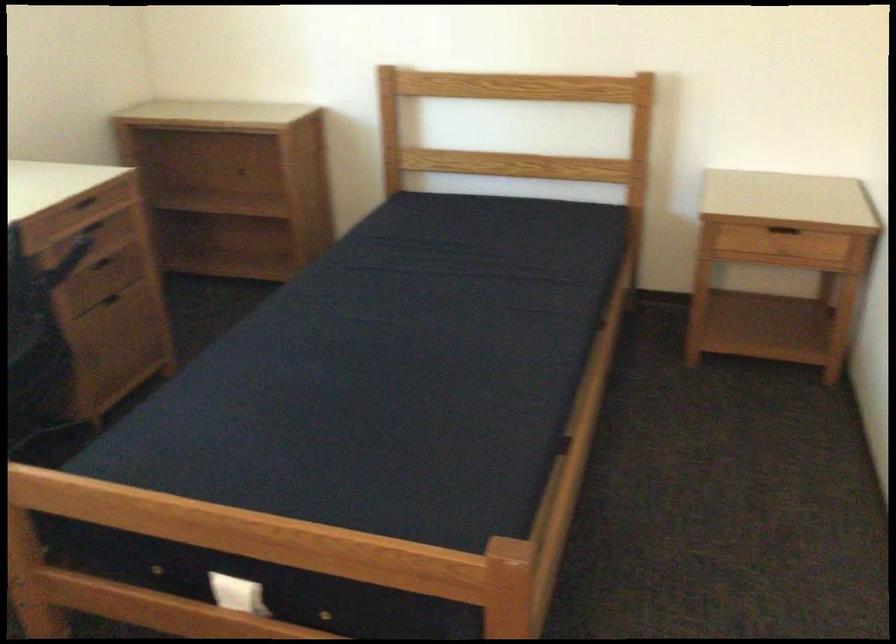
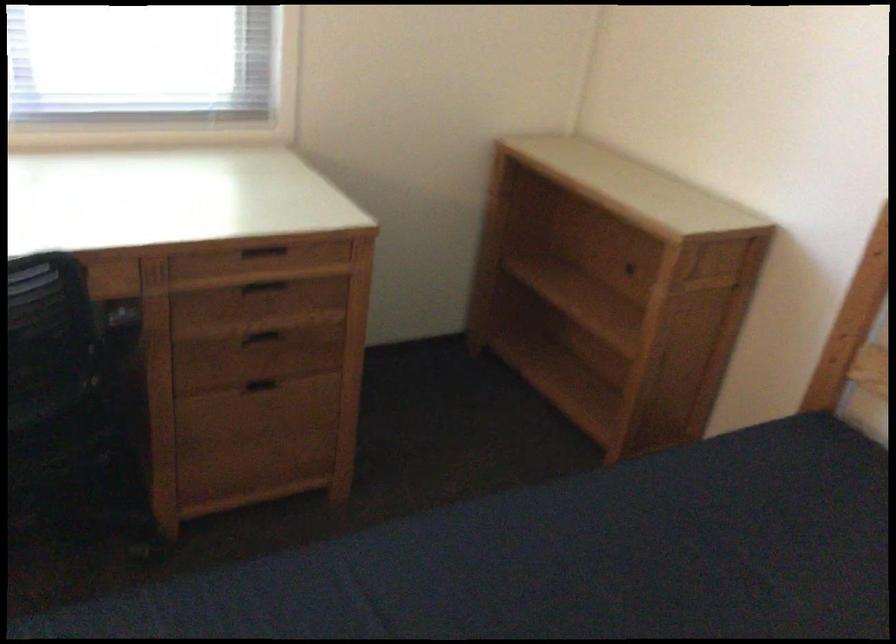
The point at (96,225) is marked in the first image. Where is the corresponding point in the second image?

(263, 285)